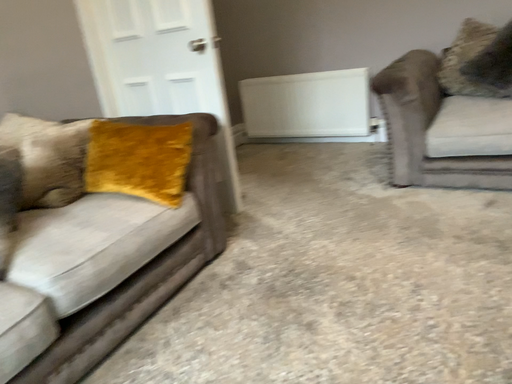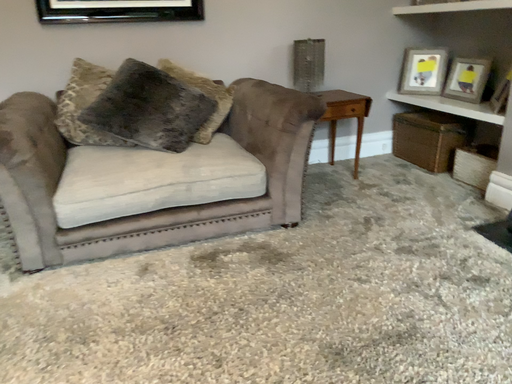
Question: How did the camera likely rotate when shooting the video?

Choices:
 (A) rotated upward
 (B) rotated downward

Answer: (A)